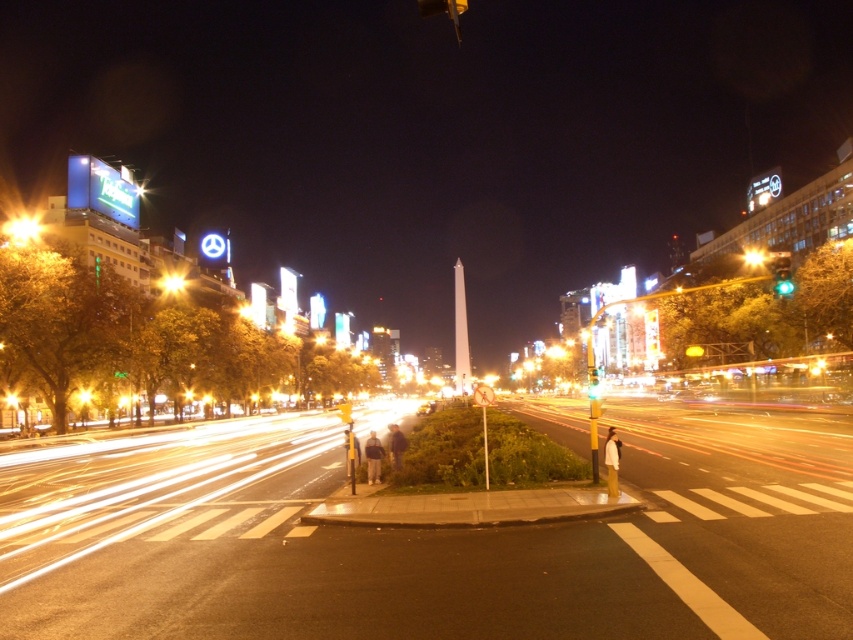
This screenshot has height=640, width=853. What do you see at coordinates (21, 228) in the screenshot?
I see `metallic billboard at upper left` at bounding box center [21, 228].

Which is behind, point (22, 230) or point (375, 474)?

The point (22, 230) is more distant.

The width and height of the screenshot is (853, 640). What are the coordinates of `metallic billboard at upper left` in the screenshot? It's located at (21, 228).

Describe the element at coordinates (782, 275) in the screenshot. I see `green glass traffic light at right` at that location.

From the picture: Can you confirm if green glass traffic light at right is wider than white matte jacket at lower center?

No.

Does point (778, 284) come behind point (618, 442)?

Yes.

This screenshot has width=853, height=640. In order to click on green glass traffic light at right in this screenshot , I will do `click(782, 275)`.

Which is more to the right, metallic billboard at upper left or yellow glass traffic light at upper right?

yellow glass traffic light at upper right is more to the right.

Is point (12, 236) less distant than point (752, 252)?

Yes, it is in front of point (752, 252).

Find the location of `metallic billboard at upper left`. metallic billboard at upper left is located at coordinates (21, 228).